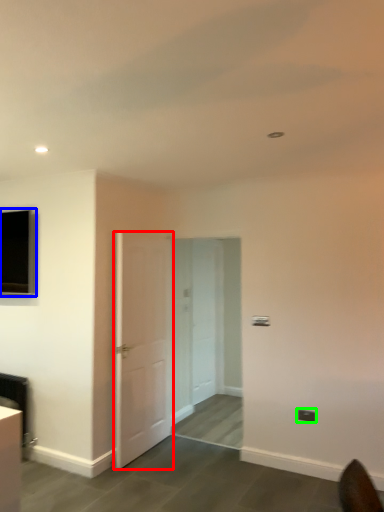
Question: Considering the real-world distances, which object is farthest from door (highlighted by a red box)? window (highlighted by a blue box) or electric outlet (highlighted by a green box)?

Choices:
 (A) window
 (B) electric outlet

Answer: (B)